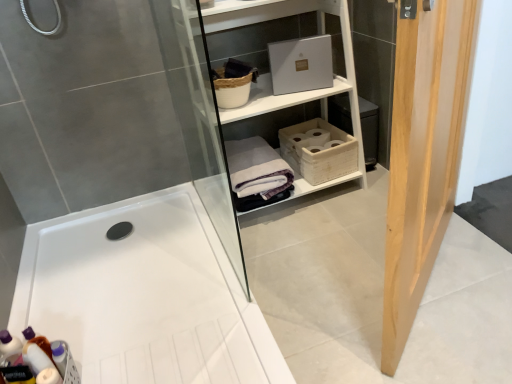
The image size is (512, 384). In order to click on free spot behind translucent plastic bottles at lower left in this screenshot , I will do `click(81, 327)`.